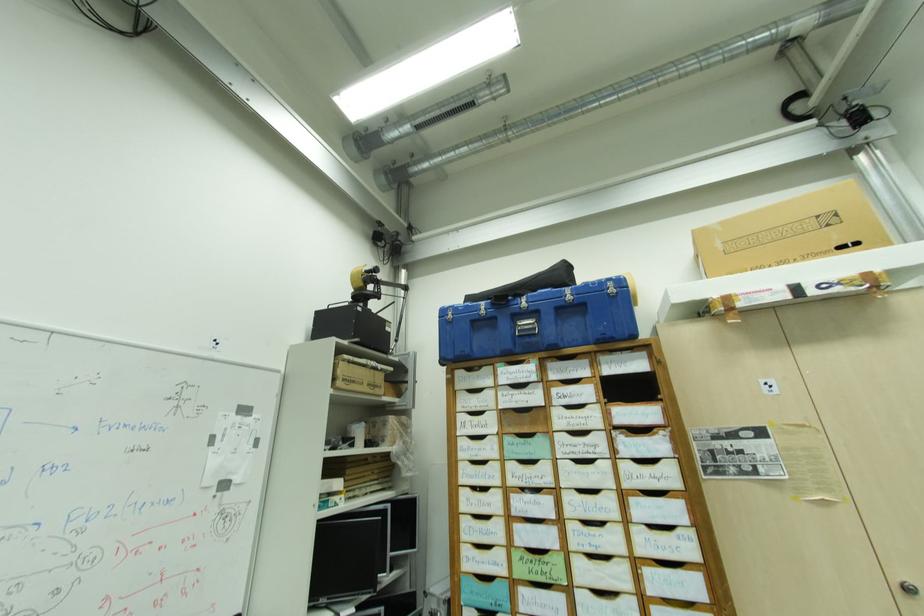
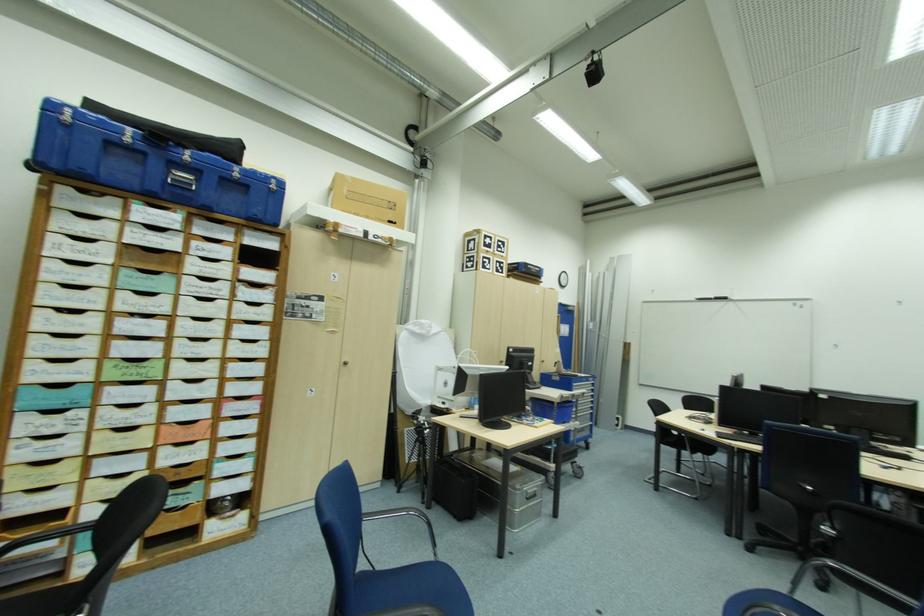
Question: Based on the continuous images, in which direction is the camera rotating? Reply with the corresponding letter.

Choices:
 (A) Left
 (B) Right
 (C) Up
 (D) Down

Answer: (B)